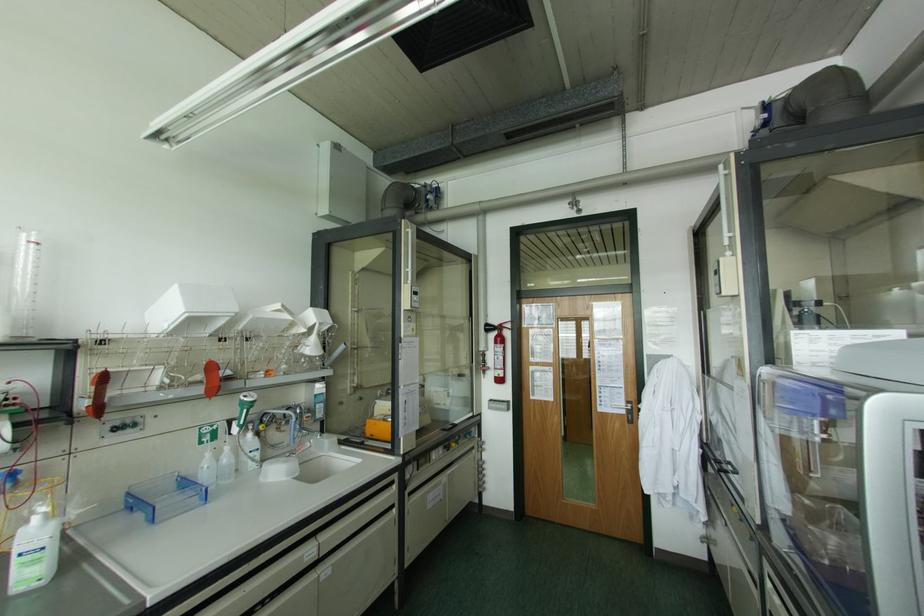
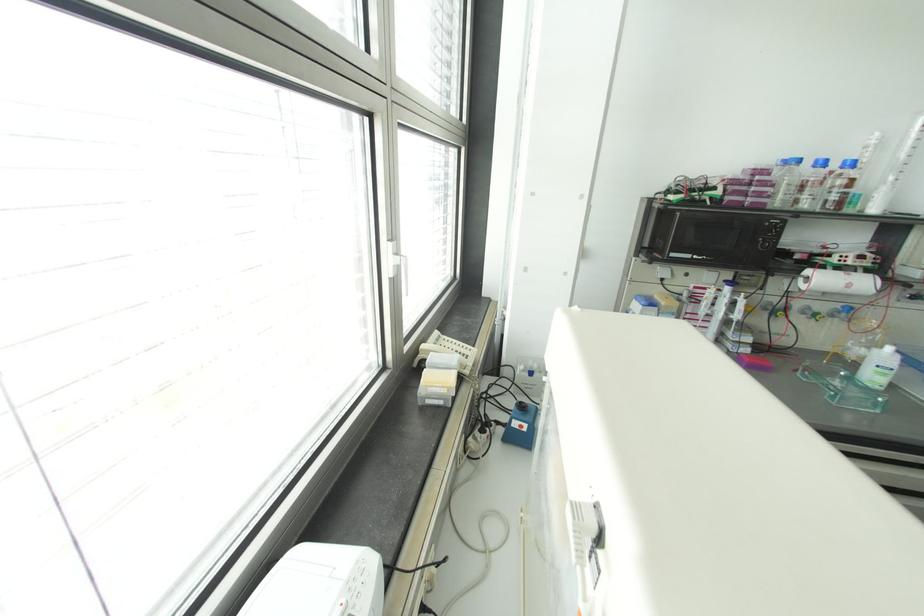
In the second image, find the point that corresponds to point (53, 523) in the first image.

(898, 355)